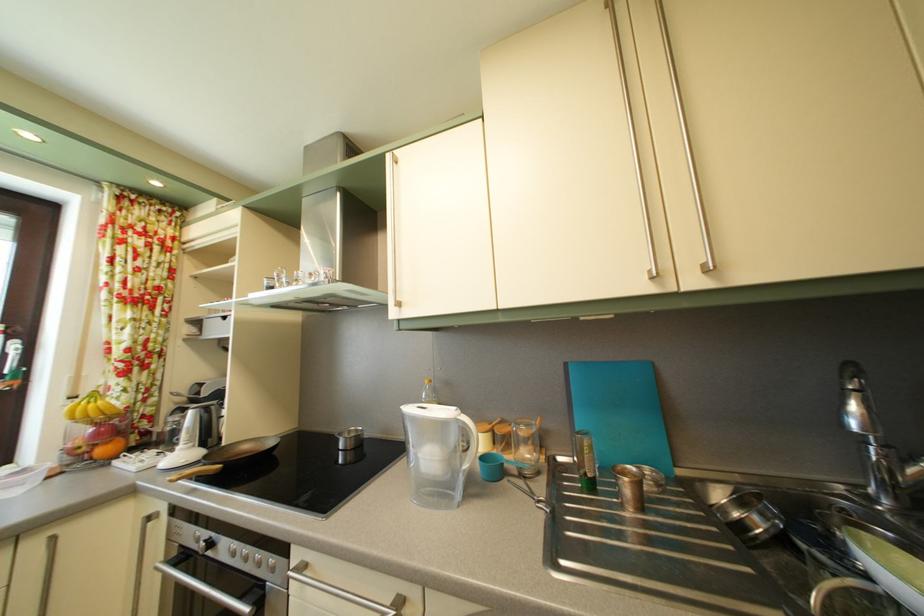
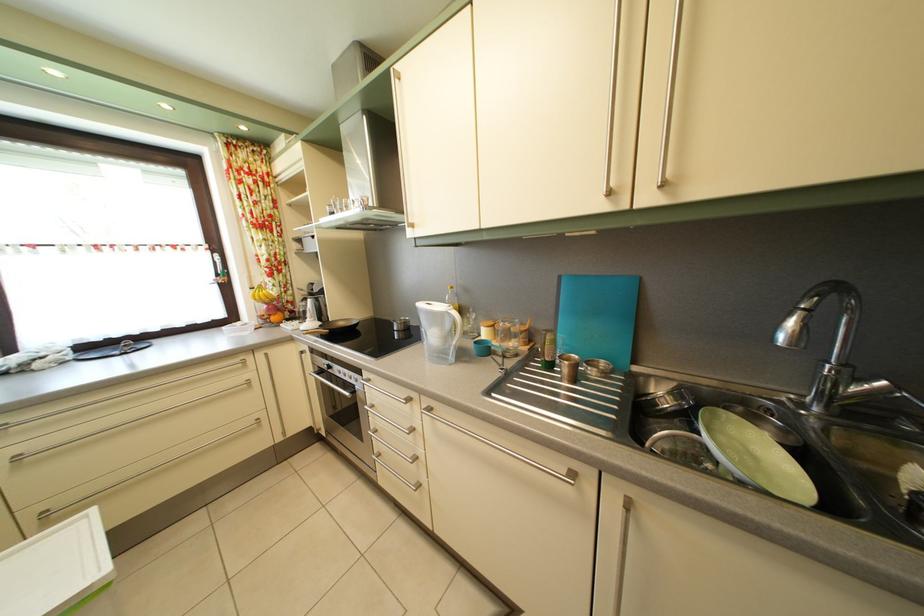
The point at (x=636, y=499) is marked in the first image. Where is the corresponding point in the second image?

(574, 378)